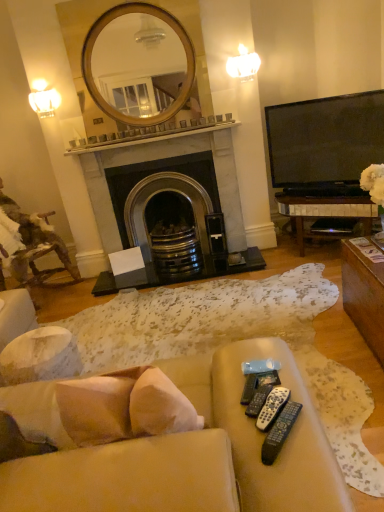
Question: Can you confirm if beige fabric couch at lower center is positioned to the right of white plastic remote controls at lower right, which is counted as the 3th remote control, starting from the back?

Choices:
 (A) yes
 (B) no

Answer: (B)

Question: Is beige fabric couch at lower center shorter than white plastic remote controls at lower right, which is counted as the 3th remote control, starting from the back?

Choices:
 (A) yes
 (B) no

Answer: (B)

Question: Considering the relative sizes of beige fabric couch at lower center and white plastic remote controls at lower right, which is counted as the 3th remote control, starting from the back, in the image provided, is beige fabric couch at lower center thinner than white plastic remote controls at lower right, which is counted as the 3th remote control, starting from the back,?

Choices:
 (A) no
 (B) yes

Answer: (A)

Question: Is beige fabric couch at lower center beside white plastic remote controls at lower right, which is counted as the second remote control, starting from the front?

Choices:
 (A) yes
 (B) no

Answer: (B)

Question: Does beige fabric couch at lower center appear on the left side of white plastic remote controls at lower right, which is counted as the 3th remote control, starting from the back?

Choices:
 (A) yes
 (B) no

Answer: (A)

Question: From the image's perspective, is beige fabric couch at lower center below white plastic remote controls at lower right, which is counted as the second remote control, starting from the front?

Choices:
 (A) yes
 (B) no

Answer: (A)

Question: Does white frosted glass sconce at upper right, which is the 2th light fixture in bottom-to-top order, have a greater width compared to white plastic remote controls at lower right, which is counted as the second remote control, starting from the front?

Choices:
 (A) yes
 (B) no

Answer: (B)

Question: Can you confirm if white frosted glass sconce at upper right, which appears as the 1th light fixture when viewed from the top, is shorter than white plastic remote controls at lower right, which is counted as the 3th remote control, starting from the back?

Choices:
 (A) yes
 (B) no

Answer: (B)

Question: Is white frosted glass sconce at upper right, which is the 2th light fixture in bottom-to-top order, turned away from white plastic remote controls at lower right, which is counted as the 3th remote control, starting from the back?

Choices:
 (A) no
 (B) yes

Answer: (A)

Question: Is white frosted glass sconce at upper right, the 1th light fixture from the right, at the right side of white plastic remote controls at lower right, which is counted as the 3th remote control, starting from the back?

Choices:
 (A) yes
 (B) no

Answer: (A)

Question: Does white frosted glass sconce at upper right, which appears as the 1th light fixture when viewed from the top, have a smaller size compared to white plastic remote controls at lower right, which is counted as the second remote control, starting from the front?

Choices:
 (A) no
 (B) yes

Answer: (A)

Question: Is the position of white frosted glass sconce at upper right, which appears as the 1th light fixture when viewed from the top, more distant than that of white plastic remote controls at lower right, which is counted as the second remote control, starting from the front?

Choices:
 (A) yes
 (B) no

Answer: (A)

Question: Considering the relative sizes of black marble fireplace at center and matte white lampshade at upper left, which is the second light fixture in right-to-left order, in the image provided, is black marble fireplace at center bigger than matte white lampshade at upper left, which is the second light fixture in right-to-left order,?

Choices:
 (A) no
 (B) yes

Answer: (B)